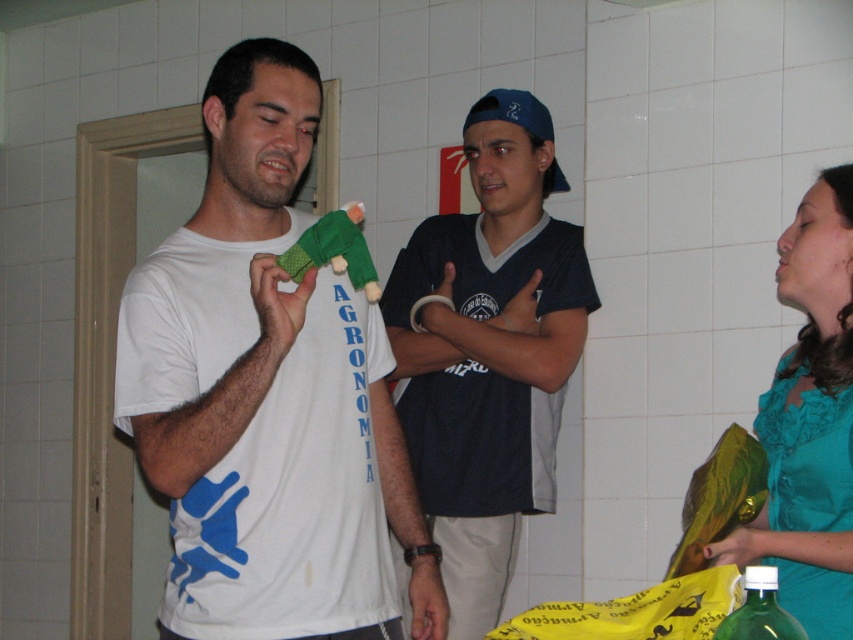
You are organizing a photoshoot and need to place a teal satin blouse at right and a green fabric parrot at center in a display case. The case has a width of 1.2 meters. Can both items fit side by side without overlapping?

The teal satin blouse at right might be wider than green fabric parrot at center. If the teal satin blouse at right is wider than the parrot, their combined width could exceed 1.2 meters, so they might not fit side by side without overlapping. Check their exact widths to confirm.

Please describe the position of the dark blue jersey at center in terms of coordinates relative to the image frame. The image frame is considered to have coordinates from 0 to 1 on both the x and y axes. The origin is at the bottom left corner of the image. The dark blue jersey at center is represented by point (488,352). Please provide the coordinates in the format of x,y.

The dark blue jersey at center is located at coordinates (488,352) relative to the image frame.